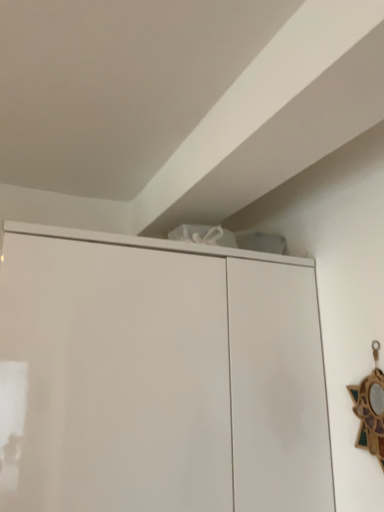
This screenshot has width=384, height=512. What do you see at coordinates (158, 377) in the screenshot?
I see `white glossy cupboard at upper center` at bounding box center [158, 377].

This screenshot has width=384, height=512. In order to click on white glossy cupboard at upper center in this screenshot , I will do `click(158, 377)`.

What is the approximate width of white glossy cupboard at upper center?

white glossy cupboard at upper center is 24.42 inches in width.

Where is `white glossy cupboard at upper center`? The width and height of the screenshot is (384, 512). white glossy cupboard at upper center is located at coordinates (158, 377).